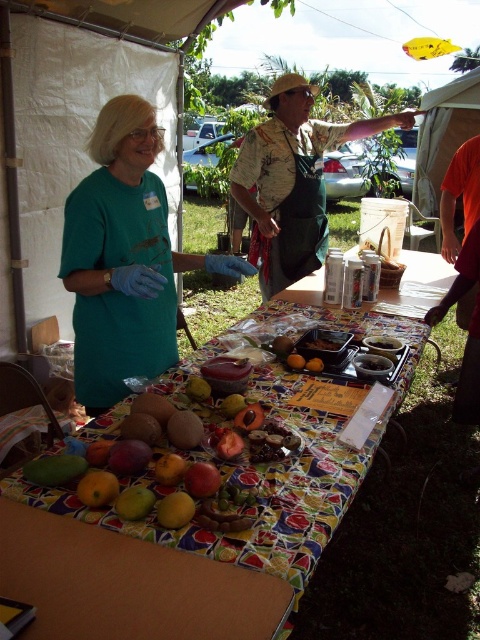
Can you confirm if teal fabric shirt at upper left is positioned to the right of yellow matte mango at lower left?

Yes, teal fabric shirt at upper left is to the right of yellow matte mango at lower left.

Does point (140, 333) lie in front of point (76, 493)?

No, (140, 333) is further to viewer.

In order to click on teal fabric shirt at upper left in this screenshot , I will do `click(123, 259)`.

Between yellow matte mango at center and green matte mango at center, which one appears on the right side from the viewer's perspective?

Positioned to the right is yellow matte mango at center.

This screenshot has height=640, width=480. In order to click on yellow matte mango at center in this screenshot , I will do `click(175, 509)`.

Image resolution: width=480 pixels, height=640 pixels. What are the coordinates of `yellow matte mango at center` in the screenshot? It's located at (175, 509).

Is hawaiian shirt at center bigger than yellow matte mango at center?

Indeed, hawaiian shirt at center has a larger size compared to yellow matte mango at center.

Does hawaiian shirt at center appear on the left side of yellow matte mango at center?

No, hawaiian shirt at center is not to the left of yellow matte mango at center.

Is point (277, 228) positioned in front of point (175, 516)?

That is False.

Find the location of a particular element. The width and height of the screenshot is (480, 640). hawaiian shirt at center is located at coordinates (291, 180).